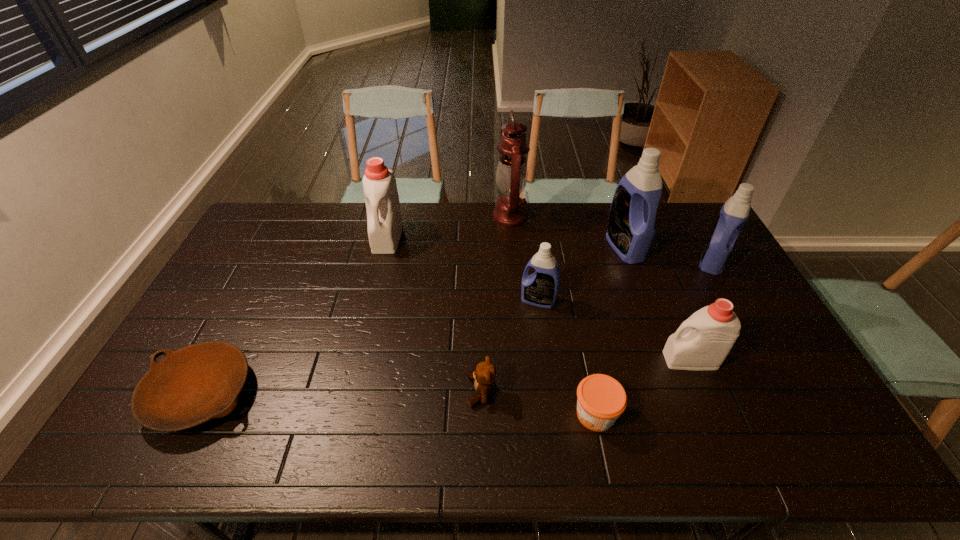
Locate an element on the screen. the smaller white detergent is located at coordinates (702, 342).

At what (x,y) coordinates should I click in order to perform the action: click on teddy bear. Please return your answer as a coordinate pair (x, y). Looking at the image, I should click on (485, 375).

What are the coordinates of `the third object from left to right` in the screenshot? It's located at (485, 375).

At what (x,y) coordinates should I click in order to perform the action: click on jam. Please return your answer as a coordinate pair (x, y). The width and height of the screenshot is (960, 540). Looking at the image, I should click on (601, 399).

Where is `brown plate`? The height and width of the screenshot is (540, 960). brown plate is located at coordinates (200, 382).

At what (x,y) coordinates should I click in order to perform the action: click on the shortest object. Please return your answer as a coordinate pair (x, y). This screenshot has height=540, width=960. Looking at the image, I should click on (200, 382).

What are the coordinates of `vacant space located 0.220m on the right of the oil lamp` in the screenshot? It's located at (584, 217).

Find the location of a particular element. vacant space located 0.110m on the front of the tallest detergent is located at coordinates (640, 289).

This screenshot has height=540, width=960. I want to click on free spot located 0.090m on the handle side of the left white detergent, so click(378, 273).

The image size is (960, 540). Find the location of `free spot located 0.080m on the front of the rightmost object`. free spot located 0.080m on the front of the rightmost object is located at coordinates (731, 294).